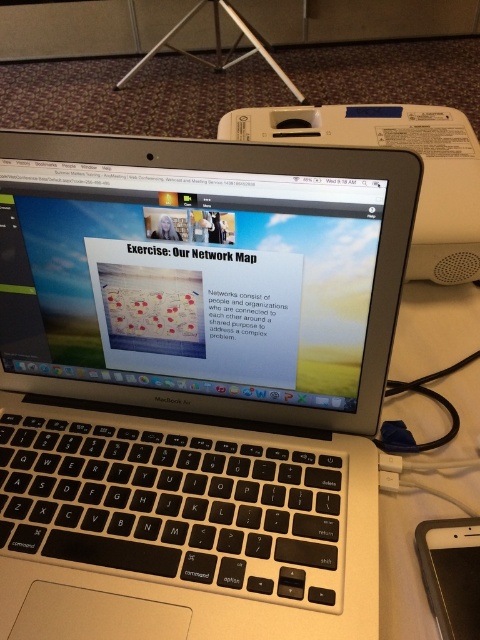
Question: In this image, where is satin silver laptop at center located relative to black plastic ipad at lower right?

Choices:
 (A) below
 (B) above

Answer: (B)

Question: Is silver metallic laptop at center below white plastic speaker at upper right?

Choices:
 (A) no
 (B) yes

Answer: (B)

Question: Which point is closer to the camera?

Choices:
 (A) white plastic speaker at upper right
 (B) black plastic ipad at lower right
 (C) silver metallic laptop at center

Answer: (C)

Question: Estimate the real-world distances between objects in this image. Which object is closer to the black plastic ipad at lower right?

Choices:
 (A) satin silver laptop at center
 (B) white plastic speaker at upper right

Answer: (A)

Question: Does satin silver laptop at center lie in front of white plastic speaker at upper right?

Choices:
 (A) yes
 (B) no

Answer: (B)

Question: Which point is farther to the camera?

Choices:
 (A) white plastic speaker at upper right
 (B) satin silver laptop at center

Answer: (B)